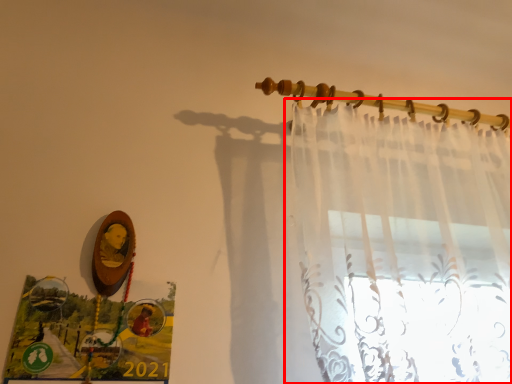
Question: From the image's perspective, where is curtain (annotated by the red box) located relative to clothesline?

Choices:
 (A) above
 (B) below

Answer: (B)